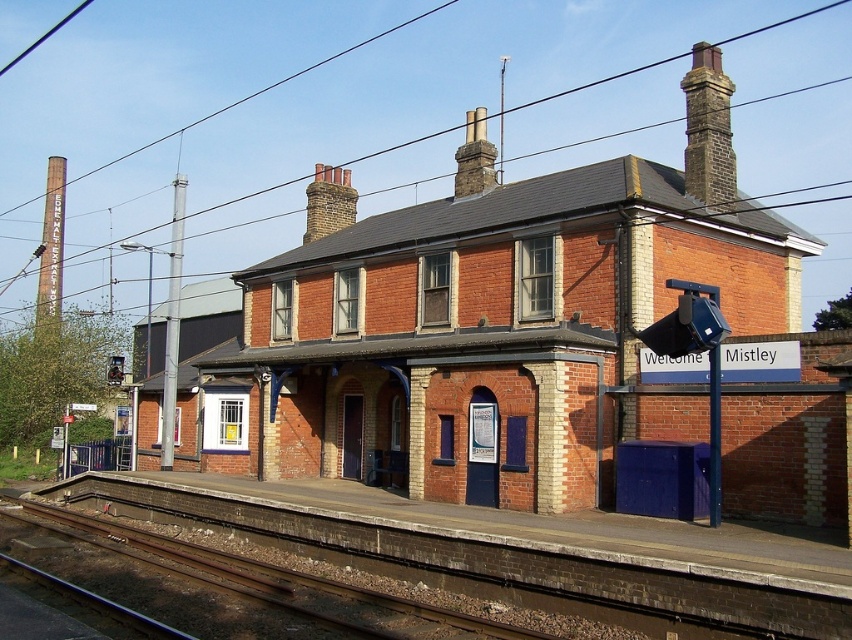
Question: Among these points, which one is farthest from the camera?

Choices:
 (A) (699, 104)
 (B) (194, 552)

Answer: (A)

Question: Which object is closer to the camera taking this photo?

Choices:
 (A) dark brown stone chimney at upper right
 (B) rusty metal train track at lower left

Answer: (B)

Question: Is rusty metal train track at lower left to the right of dark brown stone chimney at upper right from the viewer's perspective?

Choices:
 (A) no
 (B) yes

Answer: (A)

Question: Can you confirm if rusty metal train track at lower left is bigger than dark brown stone chimney at upper right?

Choices:
 (A) no
 (B) yes

Answer: (A)

Question: Is rusty metal train track at lower left below dark brown stone chimney at upper right?

Choices:
 (A) no
 (B) yes

Answer: (B)

Question: Which of the following is the closest to the observer?

Choices:
 (A) rusty metal train track at lower left
 (B) dark brown stone chimney at upper right

Answer: (A)